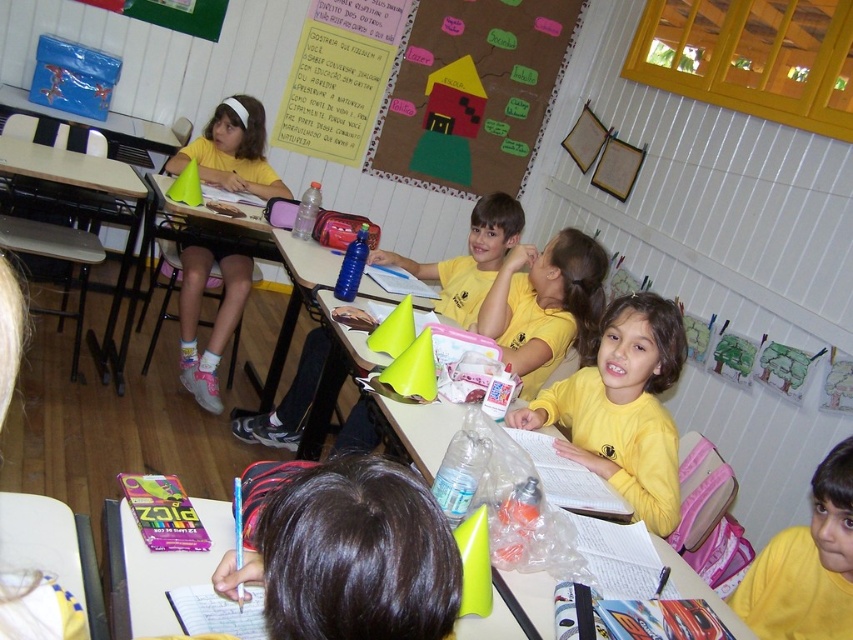
Question: Is white plastic table at lower center thinner than matte blue water bottle at center?

Choices:
 (A) no
 (B) yes

Answer: (B)

Question: Which of the following is the farthest from the observer?

Choices:
 (A) brown wooden table at left
 (B) yellow matte shirt at center
 (C) matte blue water bottle at center
 (D) cardboard poster at upper center

Answer: (D)

Question: Which point is closer to the camera?

Choices:
 (A) (494, 252)
 (B) (234, 307)
 (C) (834, 492)

Answer: (C)

Question: Does brown hair at center have a greater width compared to yellow matte shirt at lower right?

Choices:
 (A) yes
 (B) no

Answer: (A)

Question: Considering the real-world distances, which object is closest to the brown hair at center?

Choices:
 (A) brown wooden table at left
 (B) matte blue water bottle at center

Answer: (B)

Question: Can you confirm if brown hair at center is positioned below brown wooden table at left?

Choices:
 (A) yes
 (B) no

Answer: (A)